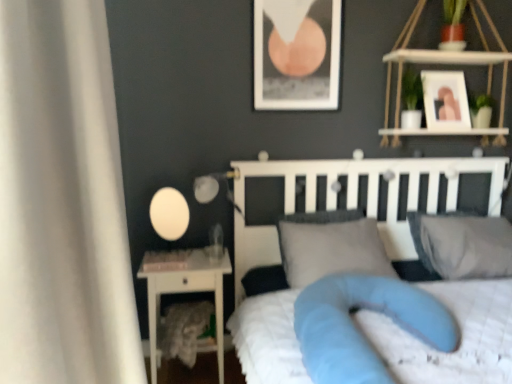
Question: From a real-world perspective, is white glossy picture frame at upper right, the second picture frame viewed from the left, positioned over matte black picture frame at upper center, marked as the second picture frame in a right-to-left arrangement, based on gravity?

Choices:
 (A) no
 (B) yes

Answer: (A)

Question: Considering the relative sizes of white glossy picture frame at upper right, the first picture frame from the right, and matte black picture frame at upper center, which is the 1th picture frame from left to right, in the image provided, is white glossy picture frame at upper right, the first picture frame from the right, bigger than matte black picture frame at upper center, which is the 1th picture frame from left to right,?

Choices:
 (A) yes
 (B) no

Answer: (A)

Question: Is white glossy picture frame at upper right, the second picture frame viewed from the left, thinner than matte black picture frame at upper center, marked as the second picture frame in a right-to-left arrangement?

Choices:
 (A) yes
 (B) no

Answer: (B)

Question: Does white glossy picture frame at upper right, the second picture frame viewed from the left, appear on the left side of matte black picture frame at upper center, which is the 1th picture frame from left to right?

Choices:
 (A) no
 (B) yes

Answer: (A)

Question: Is white glossy picture frame at upper right, the first picture frame from the right, touching matte black picture frame at upper center, marked as the second picture frame in a right-to-left arrangement?

Choices:
 (A) yes
 (B) no

Answer: (B)

Question: From a real-world perspective, is white glossy picture frame at upper right, the first picture frame from the right, below matte black picture frame at upper center, which is the 1th picture frame from left to right?

Choices:
 (A) no
 (B) yes

Answer: (B)

Question: Does matte white glass at left, the 1th table lamp viewed from the right, have a lesser width compared to white glossy nightstand at left?

Choices:
 (A) no
 (B) yes

Answer: (B)

Question: Is there a large distance between matte white glass at left, the 2th table lamp in the left-to-right sequence, and white glossy nightstand at left?

Choices:
 (A) no
 (B) yes

Answer: (A)

Question: Is matte white glass at left, the 1th table lamp viewed from the right, further to the viewer compared to white glossy nightstand at left?

Choices:
 (A) yes
 (B) no

Answer: (A)

Question: Is matte white glass at left, the 1th table lamp viewed from the right, shorter than white glossy nightstand at left?

Choices:
 (A) yes
 (B) no

Answer: (A)

Question: From the image's perspective, is matte white glass at left, the 2th table lamp in the left-to-right sequence, on white glossy nightstand at left?

Choices:
 (A) yes
 (B) no

Answer: (A)

Question: Is matte white glass at left, the 1th table lamp viewed from the right, beside white glossy nightstand at left?

Choices:
 (A) no
 (B) yes

Answer: (A)

Question: From a real-world perspective, is gray fabric pillow at upper right, arranged as the 2th pillow when viewed from the left, positioned under matte white glass at left, the 1th table lamp viewed from the right, based on gravity?

Choices:
 (A) yes
 (B) no

Answer: (A)